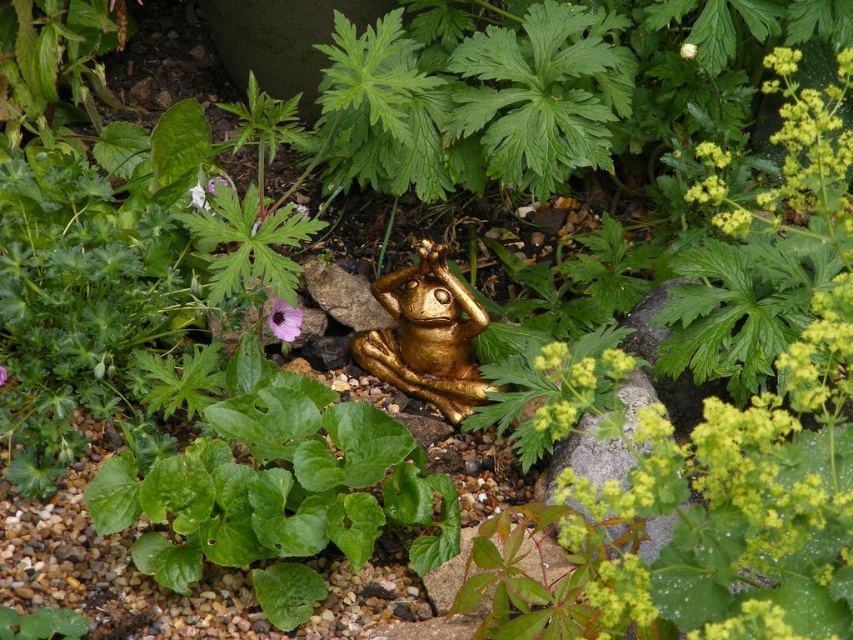
You are planning to place a new plant pot between the gold metallic frog at center and the purple matte flower at center in the garden. Considering their sizes, which object should the pot be placed closer to to ensure it doesn

The gold metallic frog at center is larger than the purple matte flower at center. To ensure the pot is appropriately sized between them, it should be placed closer to the purple matte flower at center since it is smaller and requires less space.

You are a gardener who needs to place a new plant between the gold metallic frog at center and the purple matte flower at center. Which object should you place the plant closer to if the plant requires more sunlight? Please explain your reasoning based on their positions and the scene description.

The gold metallic frog at center is taller than the purple matte flower at center. Since the frog is taller, it might cast a shadow over the flower. Therefore, to ensure the new plant receives more sunlight, you should place it closer to the gold metallic frog at center where there is less obstruction from the taller object.

You are holding a 1.5 meter long pole and want to reach the gold metallic frog at center to clean it. Can the pole reach the frog?

The gold metallic frog at center is 1.74 meters from the viewer. Since the pole is only 1.5 meters long, it cannot reach the frog.